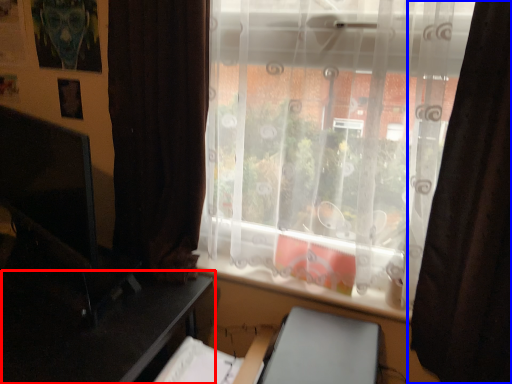
Question: Among these objects, which one is farthest to the camera, table (highlighted by a red box) or curtain (highlighted by a blue box)?

Choices:
 (A) table
 (B) curtain

Answer: (A)